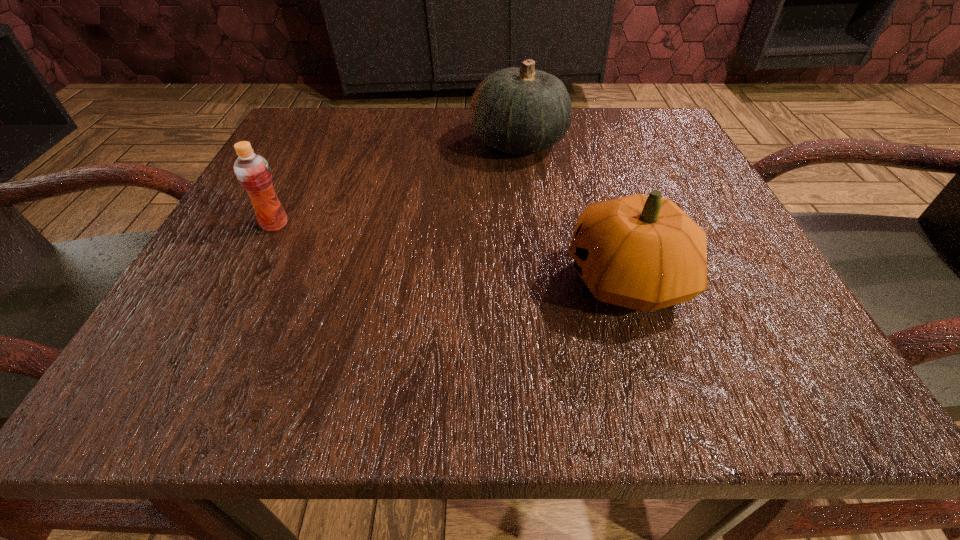
The height and width of the screenshot is (540, 960). What are the coordinates of `the farthest object` in the screenshot? It's located at (522, 110).

Where is `the nearest object`? the nearest object is located at coordinates (643, 252).

Locate an element on the screen. orange juice is located at coordinates (252, 170).

Locate an element on the screen. This screenshot has height=540, width=960. the leftmost object is located at coordinates (252, 170).

Image resolution: width=960 pixels, height=540 pixels. Find the location of `vacant region located 0.120m on the right of the farthest object`. vacant region located 0.120m on the right of the farthest object is located at coordinates (632, 143).

At what (x,y) coordinates should I click in order to perform the action: click on vacant space located on the side of the nearer gourd with the carved face. Please return your answer as a coordinate pair (x, y). Looking at the image, I should click on (347, 280).

Find the location of a particular element. The image size is (960, 540). vacant space located 0.190m on the side of the nearer gourd with the carved face is located at coordinates (417, 280).

Find the location of a particular element. This screenshot has height=540, width=960. vacant space located 0.190m on the side of the nearer gourd with the carved face is located at coordinates (417, 280).

Where is `vacant space located 0.300m on the right of the leftmost object`? The image size is (960, 540). vacant space located 0.300m on the right of the leftmost object is located at coordinates (493, 225).

Find the location of `object at the far edge`. object at the far edge is located at coordinates (522, 110).